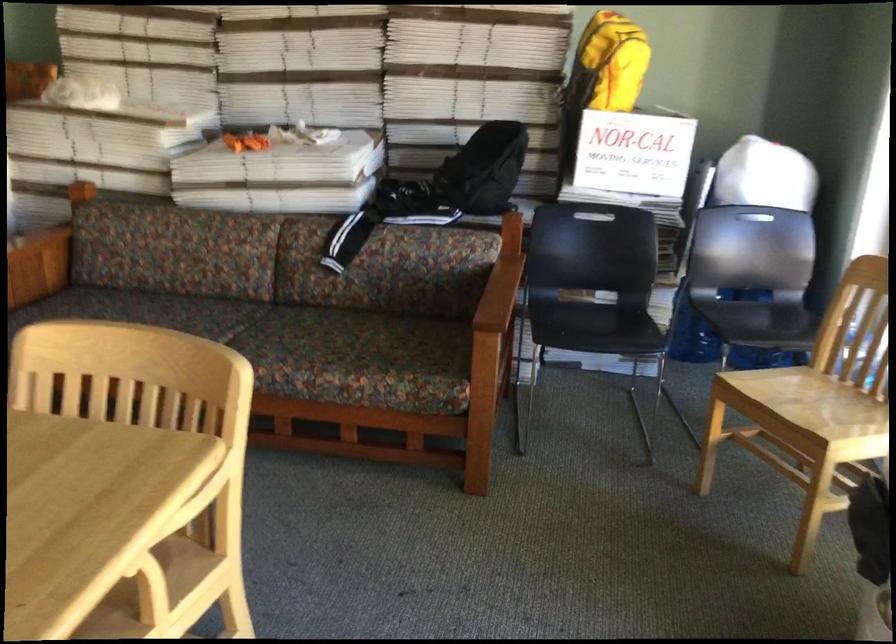
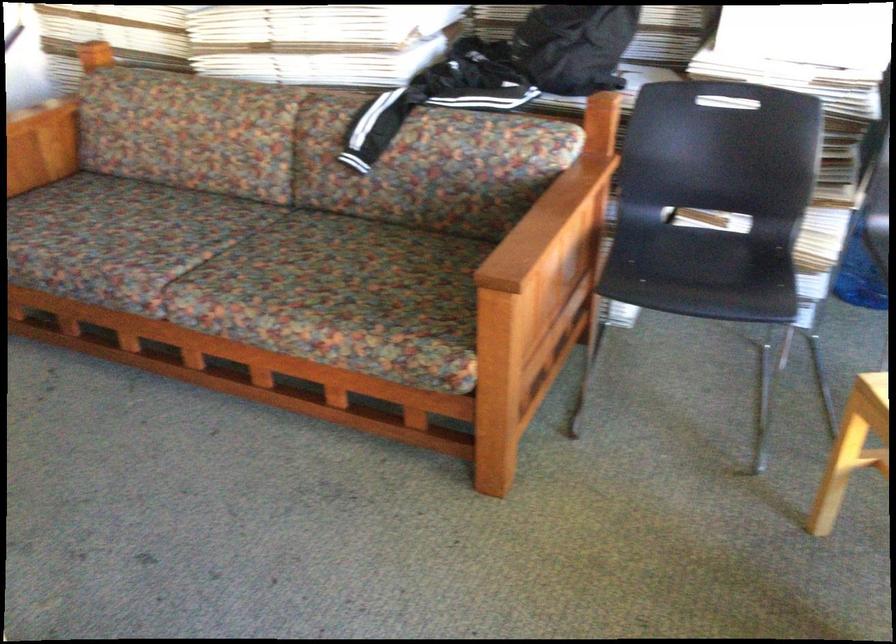
Find the pixel in the second image that matches (x=279, y=346) in the first image.

(256, 275)